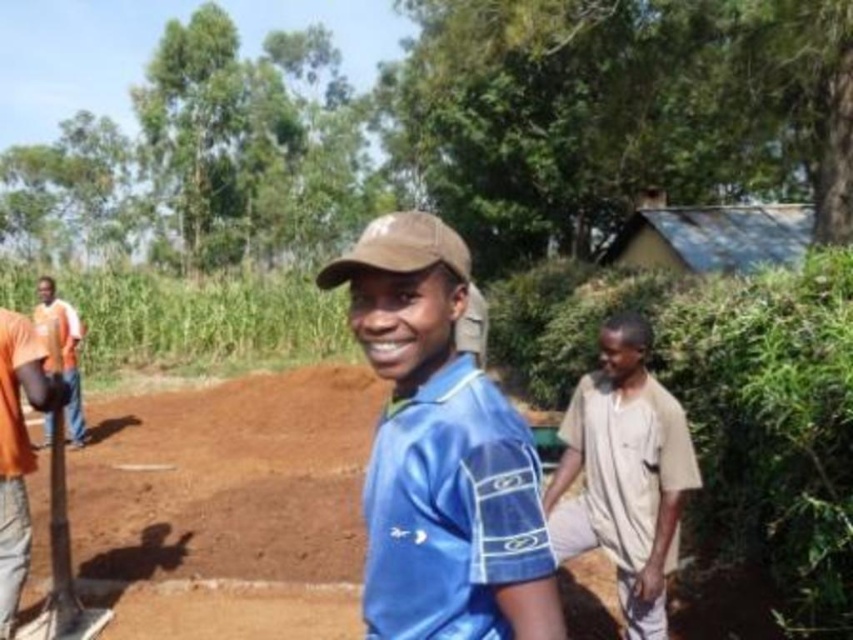
Question: Is blue fabric shirt at center below light beige cotton shirt at right?

Choices:
 (A) no
 (B) yes

Answer: (A)

Question: Can you confirm if light beige cotton shirt at right is wider than orange fabric shirt at left?

Choices:
 (A) yes
 (B) no

Answer: (A)

Question: Which object appears closest to the camera in this image?

Choices:
 (A) orange fabric shirt at left
 (B) blue fabric shirt at center
 (C) light beige cotton shirt at right

Answer: (B)

Question: Estimate the real-world distances between objects in this image. Which object is closer to the light beige cotton shirt at right?

Choices:
 (A) blue fabric shirt at center
 (B) orange fabric shirt at left

Answer: (A)

Question: Can you confirm if blue fabric shirt at center is positioned below light beige cotton shirt at right?

Choices:
 (A) yes
 (B) no

Answer: (B)

Question: Among these points, which one is nearest to the camera?

Choices:
 (A) (74, 436)
 (B) (393, 228)

Answer: (B)